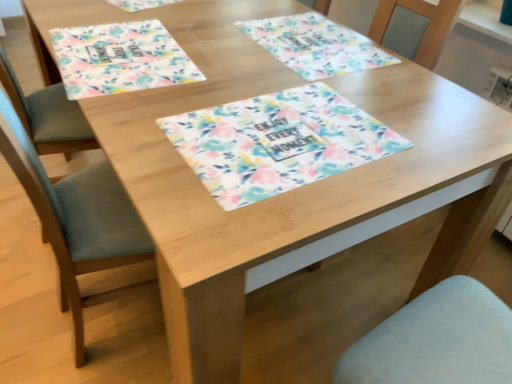
The height and width of the screenshot is (384, 512). I want to click on vacant point above floral fabric placemat at upper left, placed as the second place mat when sorted from right to left (from a real-world perspective), so click(122, 49).